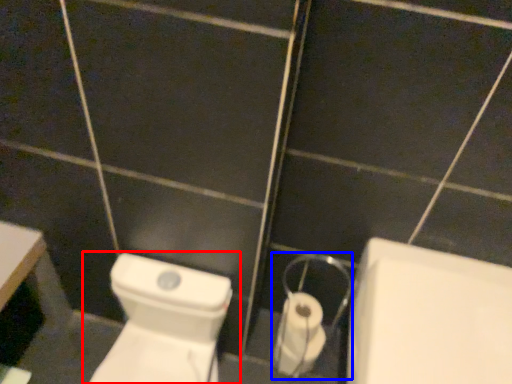
Question: Which of the following is the closest to the observer, toilet (highlighted by a red box) or dispenser (highlighted by a blue box)?

Choices:
 (A) toilet
 (B) dispenser

Answer: (A)